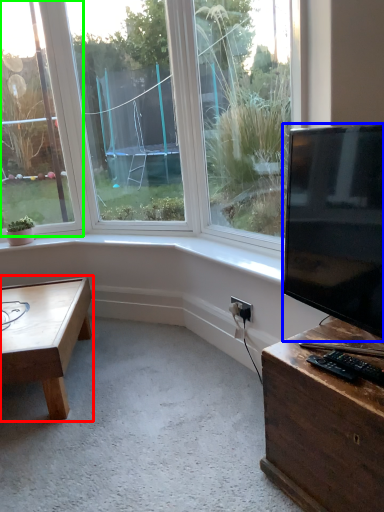
Question: Which is farther away from coffee table (highlighted by a red box)? television (highlighted by a blue box) or window (highlighted by a green box)?

Choices:
 (A) television
 (B) window

Answer: (A)